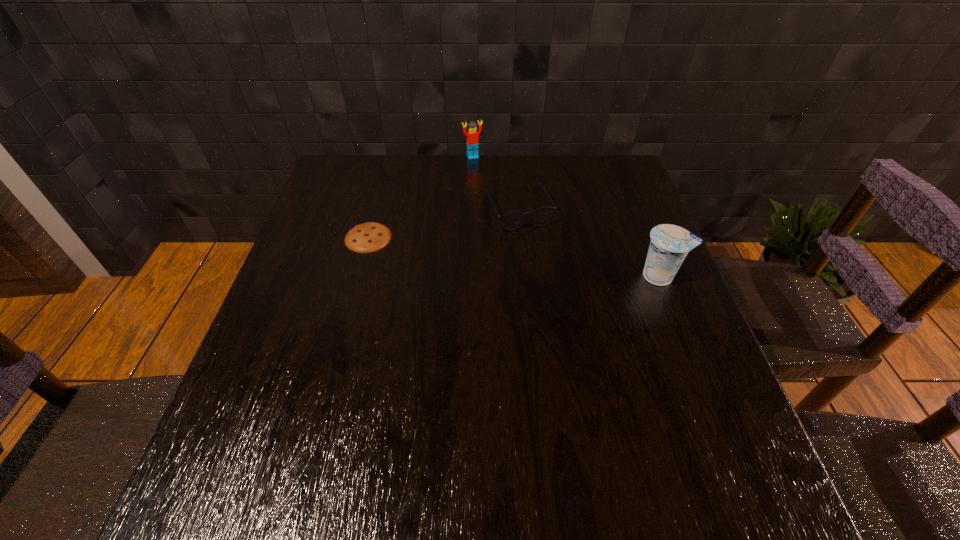
Locate an element on the screen. The image size is (960, 540). free space on the desktop that is between the leftmost object and the nearest object and is positioned on the face of the farthest object is located at coordinates (529, 259).

Where is `vacant space on the desktop that is between the shortest object and the rightmost object and is positioned on the front-facing side of the second shortest object`? The image size is (960, 540). vacant space on the desktop that is between the shortest object and the rightmost object and is positioned on the front-facing side of the second shortest object is located at coordinates (543, 261).